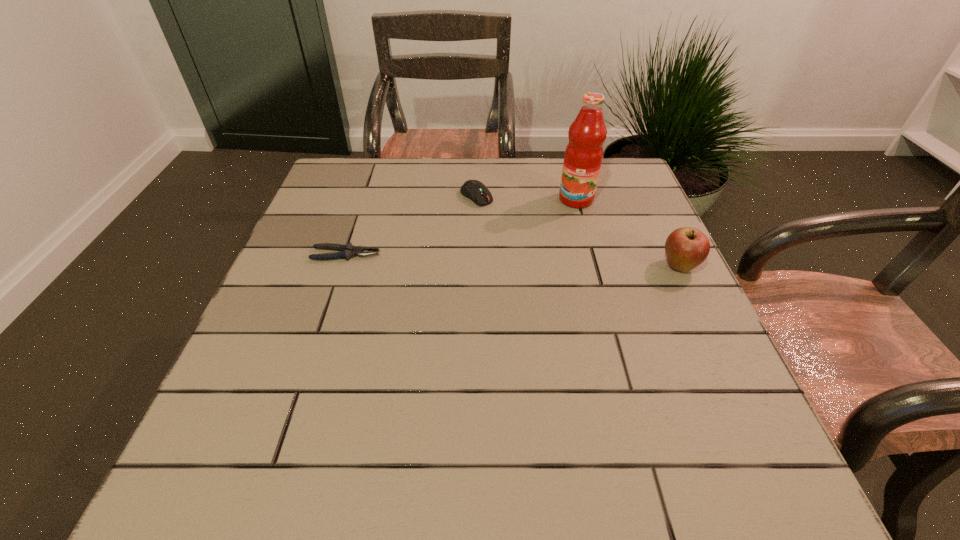
Locate an element on the screen. Image resolution: width=960 pixels, height=540 pixels. vacant space on the desktop that is between the shortest object and the apple and is positioned on the button of the computer equipment is located at coordinates [548, 262].

The height and width of the screenshot is (540, 960). In order to click on vacant spot on the desktop that is between the shortest object and the apple and is positioned on the front label of the second object from right to left in this screenshot , I will do pyautogui.click(x=552, y=262).